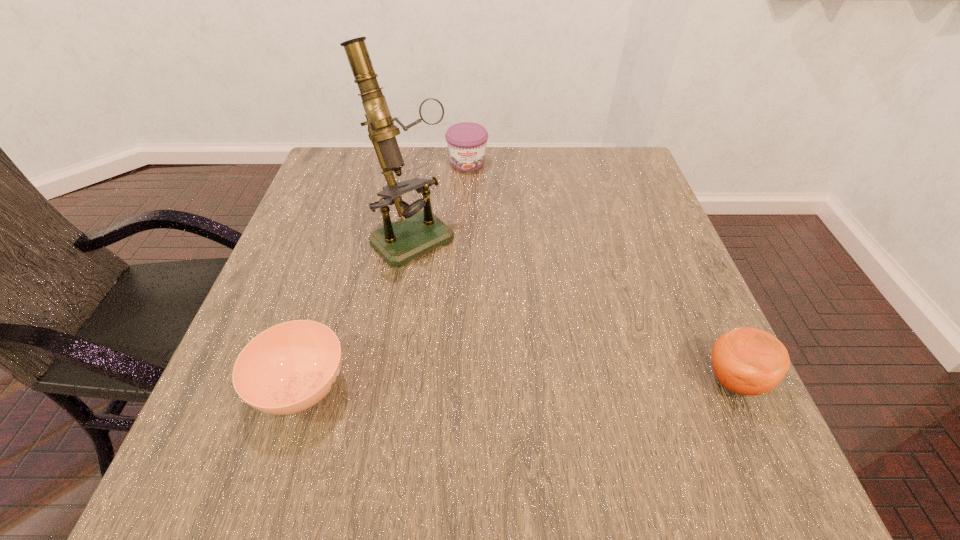
At what (x,y) coordinates should I click in order to perform the action: click on soup bowl. Please return your answer as a coordinate pair (x, y). The height and width of the screenshot is (540, 960). Looking at the image, I should click on (288, 368).

The width and height of the screenshot is (960, 540). What are the coordinates of `the third shortest object` in the screenshot? It's located at (748, 361).

This screenshot has height=540, width=960. Find the location of `orange`. orange is located at coordinates (748, 361).

The width and height of the screenshot is (960, 540). I want to click on the third nearest object, so click(419, 232).

Find the location of a particular element. the tallest object is located at coordinates (419, 232).

Locate an element on the screen. This screenshot has width=960, height=540. the third tallest object is located at coordinates (466, 141).

The image size is (960, 540). What are the coordinates of `the farthest object` in the screenshot? It's located at (466, 141).

Identify the location of blank area located on the right of the soup bowl. click(518, 387).

The height and width of the screenshot is (540, 960). Find the location of `free region located 0.340m on the back of the orange`. free region located 0.340m on the back of the orange is located at coordinates (667, 233).

You are a GUI agent. You are given a task and a screenshot of the screen. Output one action in this format:
    pyautogui.click(x=<x>, y=<y>)
    Task: Click on the vacant space located at the eyepiece of the second farthest object
    
    Given the screenshot: What is the action you would take?
    pyautogui.click(x=465, y=290)